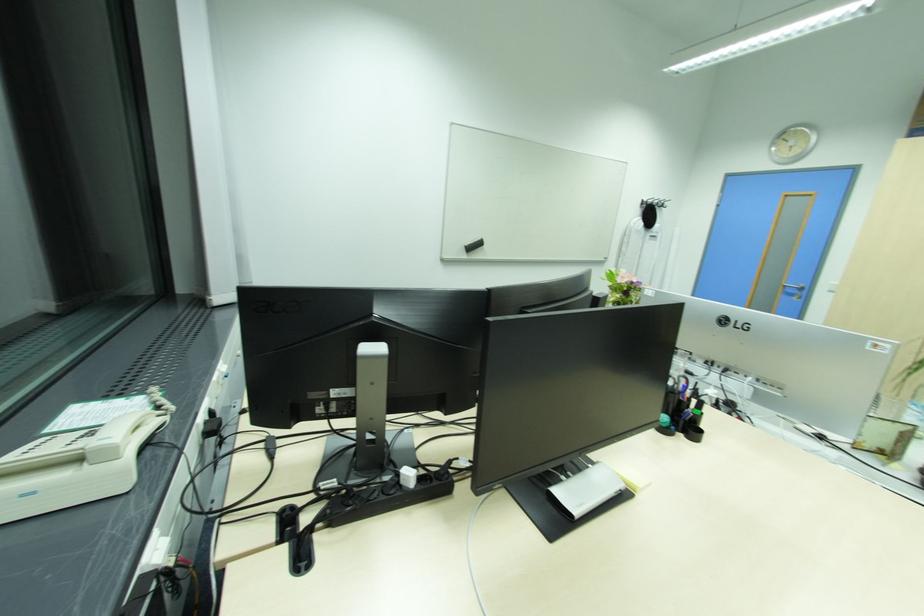
Which object does [684,403] point to?

It refers to a black pen.